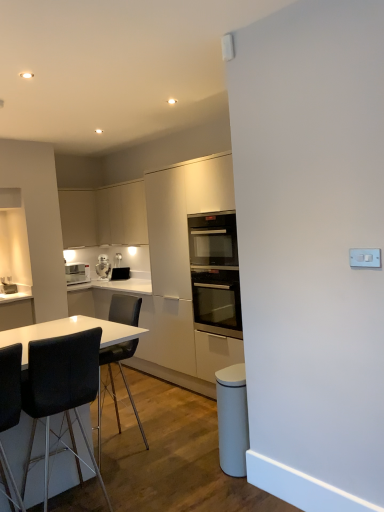
Where is `stainless steel oven at center`? stainless steel oven at center is located at coordinates (217, 301).

Image resolution: width=384 pixels, height=512 pixels. Describe the element at coordinates (10, 386) in the screenshot. I see `black leather chair at lower left, which appears as the 1th chair when viewed from the front` at that location.

Image resolution: width=384 pixels, height=512 pixels. What do you see at coordinates (120, 273) in the screenshot? I see `matte black toaster at center, which is the 2th appliance from left to right` at bounding box center [120, 273].

Find the location of `white glossy microwave at upper left, which is counted as the 1th appliance, starting from the left`. white glossy microwave at upper left, which is counted as the 1th appliance, starting from the left is located at coordinates (103, 267).

Can you confirm if matte black toaster at center, which is the 2th appliance from left to right, is shorter than white glossy microwave at upper left, which is counted as the 1th appliance, starting from the left?

Correct, matte black toaster at center, which is the 2th appliance from left to right, is not as tall as white glossy microwave at upper left, which is counted as the 1th appliance, starting from the left.

Is matte black toaster at center, the first appliance viewed from the right, oriented away from white glossy microwave at upper left, which is counted as the 1th appliance, starting from the left?

matte black toaster at center, the first appliance viewed from the right, is not turned away from white glossy microwave at upper left, which is counted as the 1th appliance, starting from the left.

From a real-world perspective, which object stands above the other?

From a 3D spatial view, white glossy microwave at upper left, the second appliance viewed from the right, is above.

From the image's perspective, is matte black toaster at center, the first appliance viewed from the right, located beneath white glossy microwave at upper left, the second appliance viewed from the right?

Indeed, from the image's perspective, matte black toaster at center, the first appliance viewed from the right, is shown beneath white glossy microwave at upper left, the second appliance viewed from the right.

Can you confirm if matte white cabinets at upper left, which appears as the first cabinetry when viewed from the right, is taller than matte white cabinet at upper left, the first cabinetry from the left?

Indeed, matte white cabinets at upper left, which appears as the first cabinetry when viewed from the right, has a greater height compared to matte white cabinet at upper left, the first cabinetry from the left.

Between point (142, 202) and point (65, 223), which one is positioned behind?

Positioned behind is point (65, 223).

Looking at this image, from the image's perspective, between matte white cabinets at upper left, which appears as the first cabinetry when viewed from the right, and matte white cabinet at upper left, the first cabinetry from the left, who is located below?

matte white cabinet at upper left, the first cabinetry from the left, from the image's perspective.

Find the location of a particular element. The image size is (384, 512). cabinetry that is behind the matte white cabinets at upper left, which appears as the first cabinetry when viewed from the right is located at coordinates (78, 218).

How distant is black glass oven at center from white glossy microwave at left?

They are 10.05 feet apart.

From the image's perspective, which is above, black glass oven at center or white glossy microwave at left?

black glass oven at center appears higher in the image.

Considering the positions of objects black glass oven at center and white glossy microwave at left in the image provided, who is in front, black glass oven at center or white glossy microwave at left?

black glass oven at center.

From a real-world perspective, does black glass oven at center stand above white glossy microwave at left?

Yes.

Which is closer to the camera, (80,280) or (228,222)?

Point (80,280) appears to be farther away from the viewer than point (228,222).

This screenshot has height=512, width=384. In order to click on home appliance that appears on the left of black glass oven at center in this screenshot , I will do `click(77, 273)`.

Considering the sizes of objects white glossy microwave at left and black glass oven at center in the image provided, who is shorter, white glossy microwave at left or black glass oven at center?

white glossy microwave at left is shorter.

Looking at the image, does white glossy microwave at left seem bigger or smaller compared to black glass oven at center?

Clearly, white glossy microwave at left is smaller in size than black glass oven at center.

Looking at this image, can you see matte white cabinet at upper left, the first cabinetry from the left, touching stainless steel oven at center?

matte white cabinet at upper left, the first cabinetry from the left, and stainless steel oven at center are clearly separated.

Would you say matte white cabinet at upper left, marked as the second cabinetry in a right-to-left arrangement, is inside or outside stainless steel oven at center?

matte white cabinet at upper left, marked as the second cabinetry in a right-to-left arrangement, cannot be found inside stainless steel oven at center.

Which of these two, matte white cabinet at upper left, the first cabinetry from the left, or stainless steel oven at center, is wider?

Wider between the two is stainless steel oven at center.

From a real-world perspective, who is located higher, matte white cabinet at upper left, the first cabinetry from the left, or stainless steel oven at center?

matte white cabinet at upper left, the first cabinetry from the left, is physically above.

Which is farther from the camera, (18, 404) or (78, 277)?

The point (78, 277) is farther.

In terms of height, does black leather chair at lower left, which is counted as the third chair, starting from the back, look taller or shorter compared to white glossy microwave at left?

In the image, black leather chair at lower left, which is counted as the third chair, starting from the back, appears to be taller than white glossy microwave at left.

Considering the relative positions of black leather chair at lower left, which is counted as the third chair, starting from the back, and white glossy microwave at left in the image provided, is black leather chair at lower left, which is counted as the third chair, starting from the back, to the left of white glossy microwave at left from the viewer's perspective?

No, black leather chair at lower left, which is counted as the third chair, starting from the back, is not to the left of white glossy microwave at left.

Between point (128, 275) and point (82, 268), which one is positioned behind?

Point (82, 268)

Is matte black toaster at center, the first appliance viewed from the right, facing away from white glossy microwave at left?

No, matte black toaster at center, the first appliance viewed from the right,'s orientation is not away from white glossy microwave at left.

You are a GUI agent. You are given a task and a screenshot of the screen. Output one action in this format:
    pyautogui.click(x=<x>, y=<y>)
    Task: Click on the appliance above the matte black toaster at center, the first appliance viewed from the right (from the image's perspective)
    The width and height of the screenshot is (384, 512).
    Given the screenshot: What is the action you would take?
    pyautogui.click(x=103, y=267)

You are a GUI agent. You are given a task and a screenshot of the screen. Output one action in this format:
    pyautogui.click(x=<x>, y=<y>)
    Task: Click on the cabinetry above the matte white cabinets at upper left, which appears as the first cabinetry when viewed from the right (from a real-world perspective)
    Image resolution: width=384 pixels, height=512 pixels.
    Given the screenshot: What is the action you would take?
    pyautogui.click(x=78, y=218)

When comparing their distances from matte black toaster at center, the first appliance viewed from the right, does black leather chair at lower left, arranged as the second chair when viewed from the back, or black leather chair at lower left, which appears as the 1th chair when viewed from the front, seem closer?

Among the two, black leather chair at lower left, arranged as the second chair when viewed from the back, is located nearer to matte black toaster at center, the first appliance viewed from the right.

Looking at the image, which one is located closer to black leather chair at lower left, arranged as the second chair when viewed from the back, white glossy microwave at left or white glossy microwave at upper left, which is counted as the 1th appliance, starting from the left?

The object closer to black leather chair at lower left, arranged as the second chair when viewed from the back, is white glossy microwave at upper left, which is counted as the 1th appliance, starting from the left.

Based on the photo, based on their spatial positions, is black leather chair at lower left, which appears as the 1th chair when viewed from the front, or black glass oven at center closer to black leather chair at lower left, arranged as the second chair when viewed from the back?

Among the two, black leather chair at lower left, which appears as the 1th chair when viewed from the front, is located nearer to black leather chair at lower left, arranged as the second chair when viewed from the back.

Looking at the image, which one is located further to black fabric chair at lower left, which appears as the 1th chair when viewed from the back, matte white cabinets at upper left, the second cabinetry viewed from the left, or stainless steel oven at center?

stainless steel oven at center is positioned further to the anchor black fabric chair at lower left, which appears as the 1th chair when viewed from the back.

When comparing their distances from matte black toaster at center, which is the 2th appliance from left to right, does stainless steel oven at center or black leather chair at lower left, which is counted as the third chair, starting from the back, seem closer?

Based on the image, stainless steel oven at center appears to be nearer to matte black toaster at center, which is the 2th appliance from left to right.

When comparing their distances from matte white cabinet at upper left, marked as the second cabinetry in a right-to-left arrangement, does black leather chair at lower left, which appears as the 1th chair when viewed from the front, or matte white cabinets at upper left, which appears as the first cabinetry when viewed from the right, seem further?

Among the two, black leather chair at lower left, which appears as the 1th chair when viewed from the front, is located further to matte white cabinet at upper left, marked as the second cabinetry in a right-to-left arrangement.

When comparing their distances from matte black toaster at center, the first appliance viewed from the right, does black leather chair at lower left, which is counted as the third chair, starting from the back, or black glass oven at center seem further?

Based on the image, black leather chair at lower left, which is counted as the third chair, starting from the back, appears to be further to matte black toaster at center, the first appliance viewed from the right.

Which object lies further to the anchor point matte black toaster at center, which is the 2th appliance from left to right, matte white cabinet at upper left, the first cabinetry from the left, or black glass oven at center?

Among the two, black glass oven at center is located further to matte black toaster at center, which is the 2th appliance from left to right.

Identify the location of kitchen appliance between black fabric chair at lower left, which appears as the 1th chair when viewed from the back, and white glossy microwave at upper left, the second appliance viewed from the right, from front to back. (213, 240).

Where is `oven between black leather chair at lower left, arranged as the second chair when viewed from the back, and white glossy microwave at upper left, which is counted as the 1th appliance, starting from the left, in the front-back direction`? The width and height of the screenshot is (384, 512). oven between black leather chair at lower left, arranged as the second chair when viewed from the back, and white glossy microwave at upper left, which is counted as the 1th appliance, starting from the left, in the front-back direction is located at coordinates (217, 301).

I want to click on oven located between black leather chair at lower left, arranged as the second chair when viewed from the back, and matte white cabinets at upper left, which appears as the first cabinetry when viewed from the right, in the depth direction, so click(217, 301).

Locate an element on the screen. home appliance between black fabric chair at lower left, acting as the third chair starting from the front, and white glossy microwave at upper left, the second appliance viewed from the right, in the front-back direction is located at coordinates (77, 273).